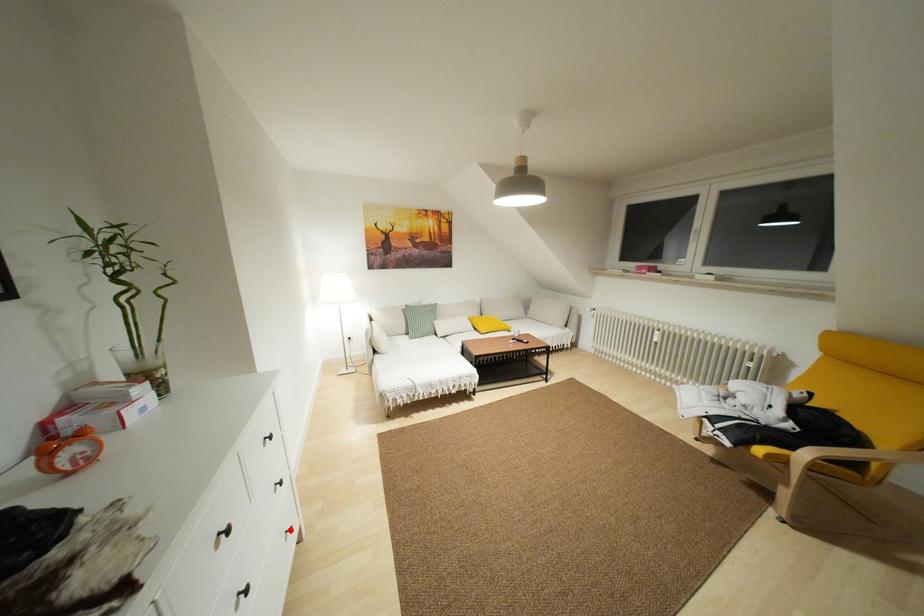
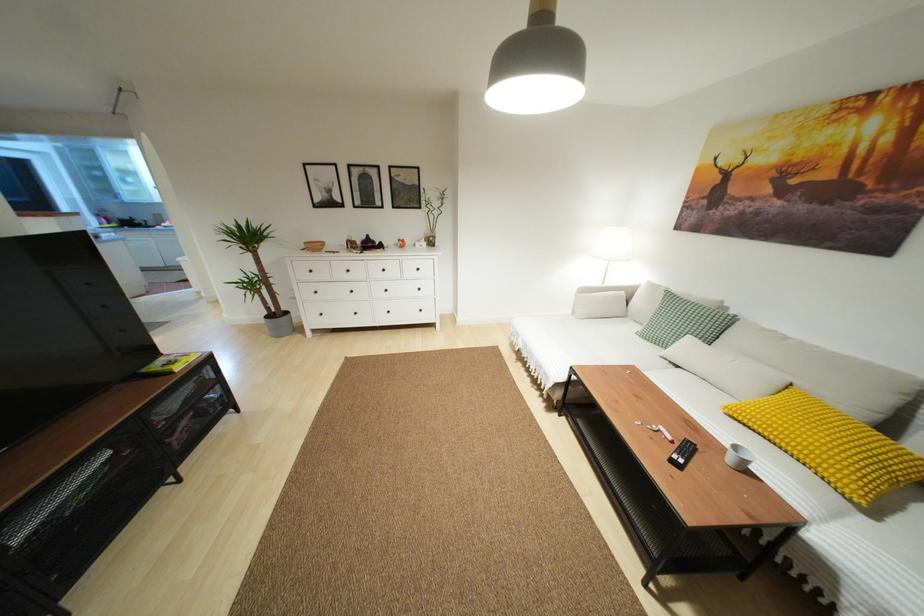
The point at the highlighted location is marked in the first image. Where is the corresponding point in the second image?

(419, 310)